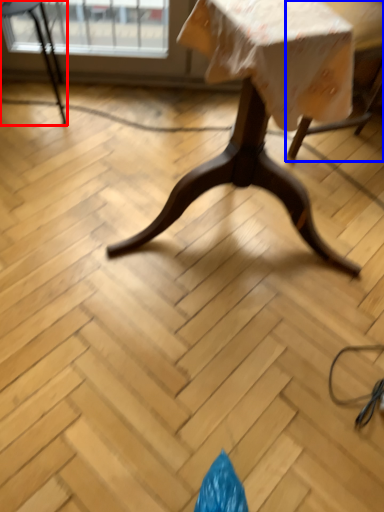
Question: Which of the following is the closest to the observer, chair (highlighted by a red box) or swivel chair (highlighted by a blue box)?

Choices:
 (A) chair
 (B) swivel chair

Answer: (B)